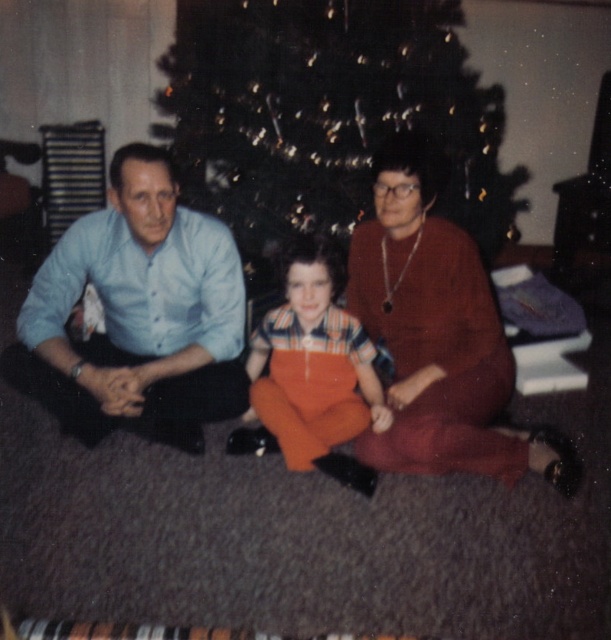
Between green textured christmas tree at center and orange cotton overalls at center, which one appears on the left side from the viewer's perspective?

Positioned to the left is orange cotton overalls at center.

Between green textured christmas tree at center and orange cotton overalls at center, which one is positioned higher?

Positioned higher is green textured christmas tree at center.

Where is `green textured christmas tree at center`? This screenshot has width=611, height=640. green textured christmas tree at center is located at coordinates (326, 112).

Which is more to the left, light blue shirt at left or orange cotton overalls at center?

Positioned to the left is light blue shirt at left.

Is light blue shirt at left closer to the viewer compared to orange cotton overalls at center?

Yes.

What are the coordinates of `light blue shirt at left` in the screenshot? It's located at (141, 308).

Which is more to the left, light blue shirt at left or matte blue shirt at center?

→ light blue shirt at left is more to the left.

Can you confirm if light blue shirt at left is wider than matte blue shirt at center?

In fact, light blue shirt at left might be narrower than matte blue shirt at center.

Is point (142, 225) positioned before point (411, 317)?

That is True.

The image size is (611, 640). What are the coordinates of `light blue shirt at left` in the screenshot? It's located at (141, 308).